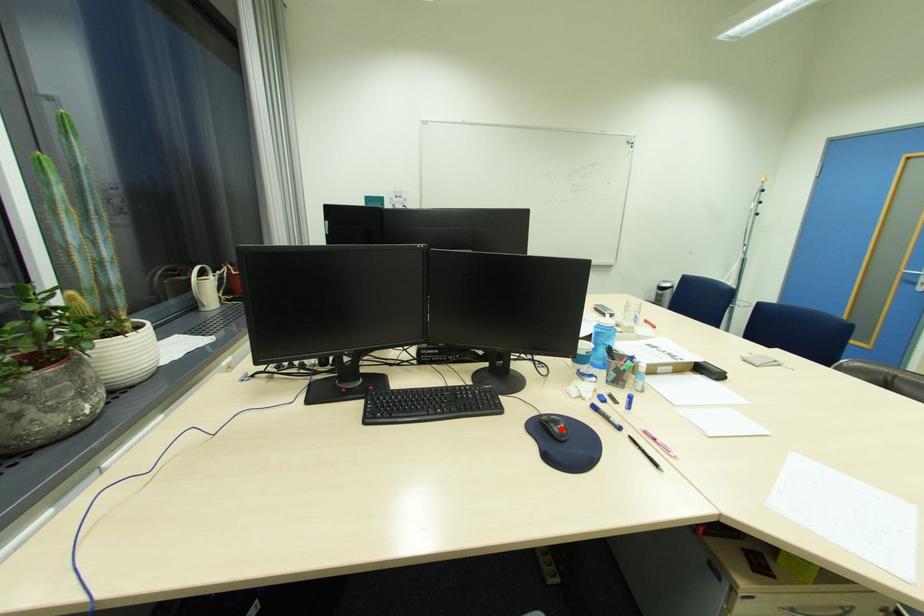
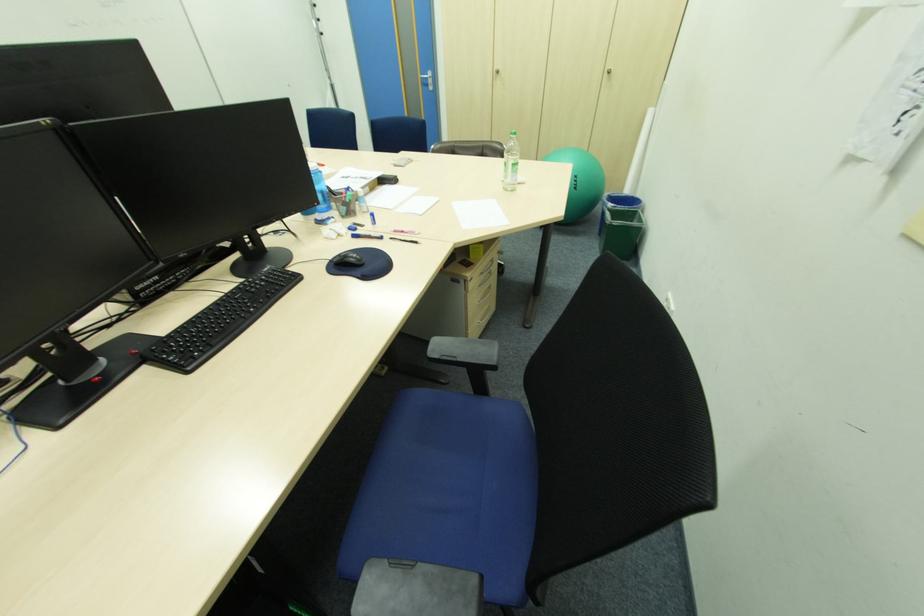
Where in the second image is the point corresponding to the highlighted location from the first image?

(357, 260)